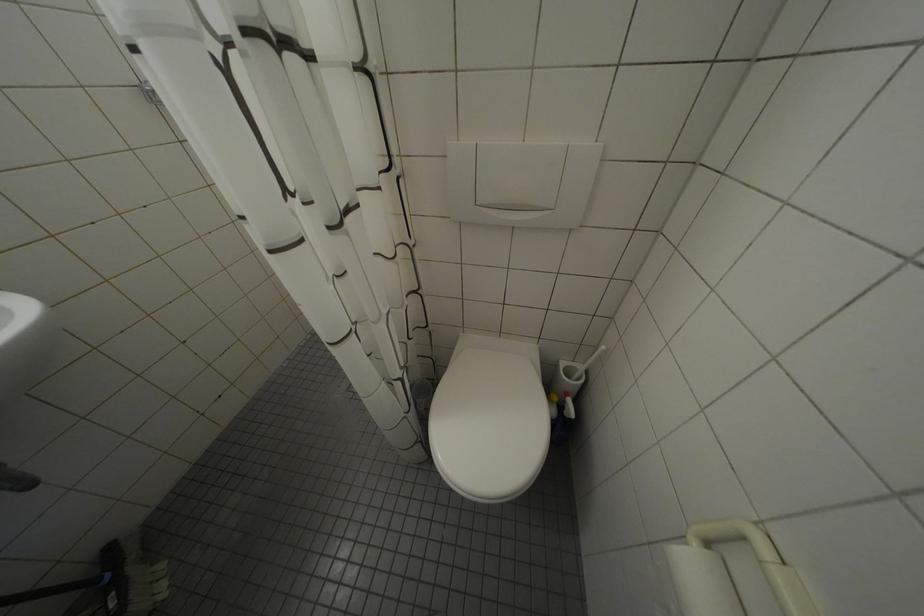
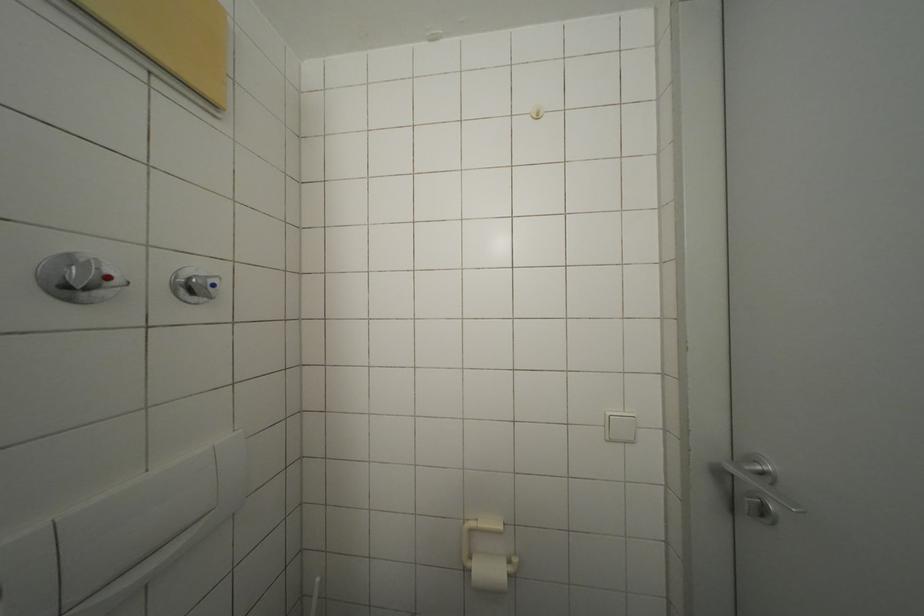
Question: The first image is from the beginning of the video and the second image is from the end. How did the camera likely rotate when shooting the video?

Choices:
 (A) Left
 (B) Right
 (C) Up
 (D) Down

Answer: (B)